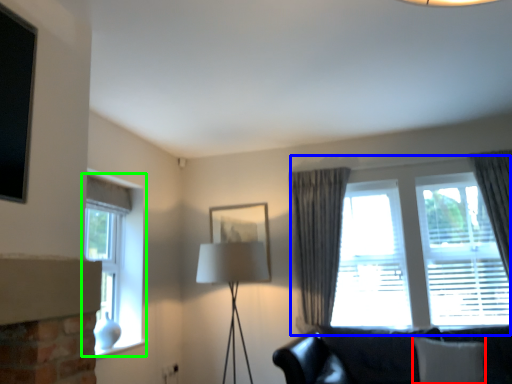
Question: Estimate the real-world distances between objects in this image. Which object is closer to pillow (highlighted by a red box), window (highlighted by a blue box) or window (highlighted by a green box)?

Choices:
 (A) window
 (B) window

Answer: (A)